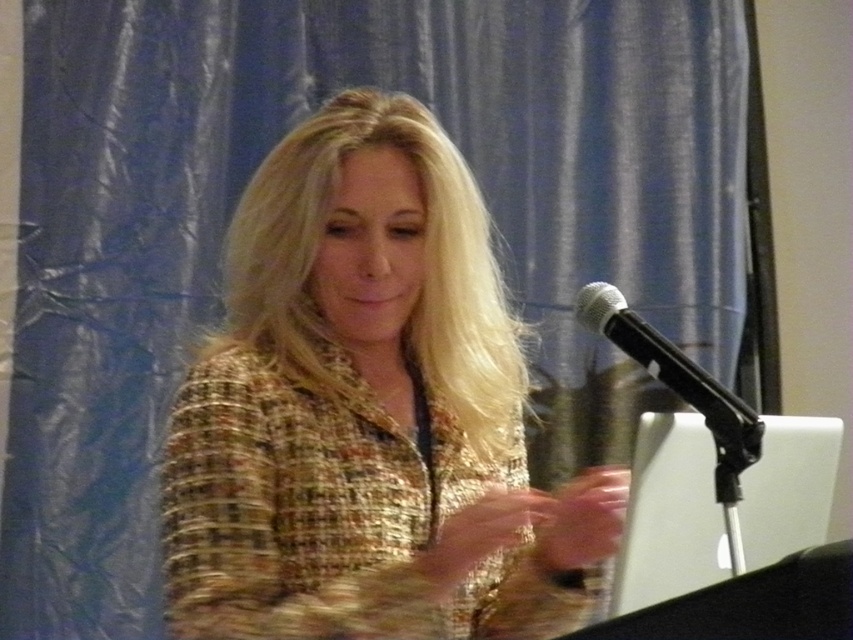
You are a photographer setting up for a presentation. You need to position a light so that it illuminates the multicolored tweed jacket at center and the black metallic microphone at upper right equally. Based on their positions, which side of the microphone should you place the light to ensure both objects receive similar lighting?

The multicolored tweed jacket at center is to the left of the black metallic microphone at upper right. To ensure both receive similar lighting, place the light to the right side of the microphone so that the light can reach both the jacket and the microphone evenly.

You are an event organizer and need to place a new speaker who is 1.8 meters tall. The podium has limited space. Considering the white plastic laptop at lower right and the black metallic microphone at upper right, which object is taller and might require adjustment to accommodate the speaker?

The white plastic laptop at lower right is much taller than the black metallic microphone at upper right. Therefore, the white plastic laptop at lower right might require adjustment to accommodate the speaker.

You are an event organizer setting up a stage. You have to place a microphone stand between the multicolored tweed jacket at center and the white plastic laptop at lower right. Since the jacket is above the laptop, where should the microphone stand be positioned relative to the laptop?

The microphone stand should be placed above the white plastic laptop at lower right because the multicolored tweed jacket at center is already positioned above it, so placing the microphone stand there would align with the jacket and laptop arrangement.